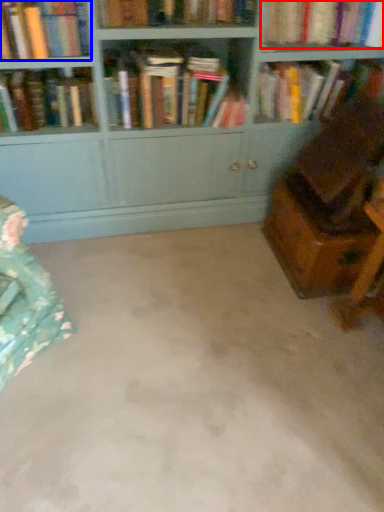
Question: Which point is closer to the camera, book (highlighted by a red box) or book (highlighted by a blue box)?

Choices:
 (A) book
 (B) book

Answer: (B)